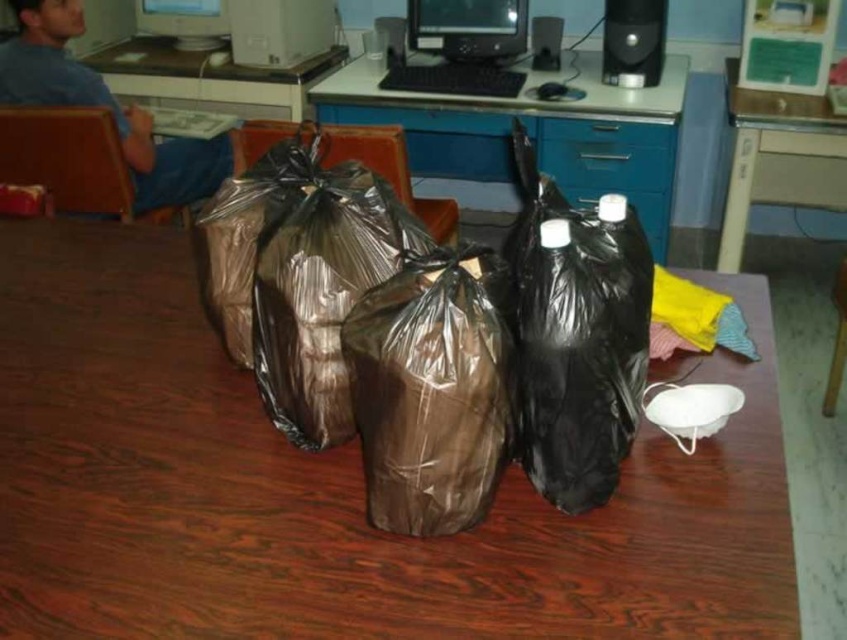
Consider the image. Who is positioned more to the left, brown leather chair at left or brown leather chair at center?

brown leather chair at left is more to the left.

Can you confirm if brown leather chair at left is positioned above brown leather chair at center?

Yes.

Is point (78, 147) closer to camera compared to point (322, 140)?

No, it is not.

Locate an element on the screen. The height and width of the screenshot is (640, 847). brown leather chair at left is located at coordinates (70, 160).

Who is more forward, (284, 56) or (167, 28)?

Positioned in front is point (284, 56).

Is white plastic computer at upper center above matte plastic monitor at upper center?

Incorrect, white plastic computer at upper center is not positioned above matte plastic monitor at upper center.

Who is more distant from viewer, [307,51] or [217,42]?

The point [217,42] is more distant.

This screenshot has width=847, height=640. I want to click on white plastic computer at upper center, so (280, 29).

In the scene shown: Is brown leather chair at left bigger than black plastic monitor at center?

Incorrect, brown leather chair at left is not larger than black plastic monitor at center.

This screenshot has width=847, height=640. In order to click on brown leather chair at left in this screenshot , I will do `click(70, 160)`.

This screenshot has width=847, height=640. In order to click on brown leather chair at left in this screenshot , I will do `click(70, 160)`.